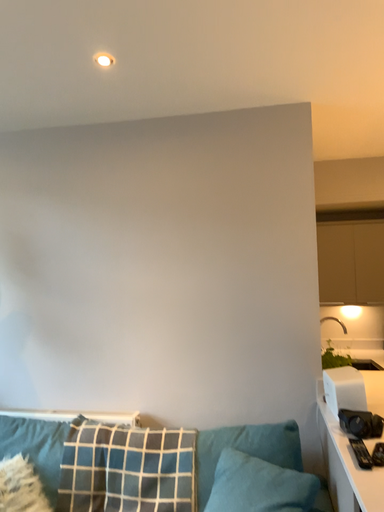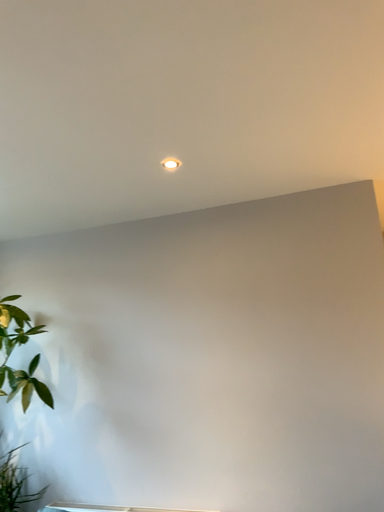
Question: Which way did the camera rotate in the video?

Choices:
 (A) rotated left
 (B) rotated right

Answer: (A)